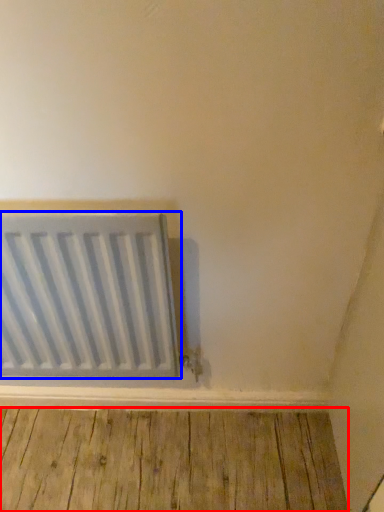
Question: Which point is closer to the camera, hardwood (highlighted by a red box) or radiator (highlighted by a blue box)?

Choices:
 (A) hardwood
 (B) radiator

Answer: (B)